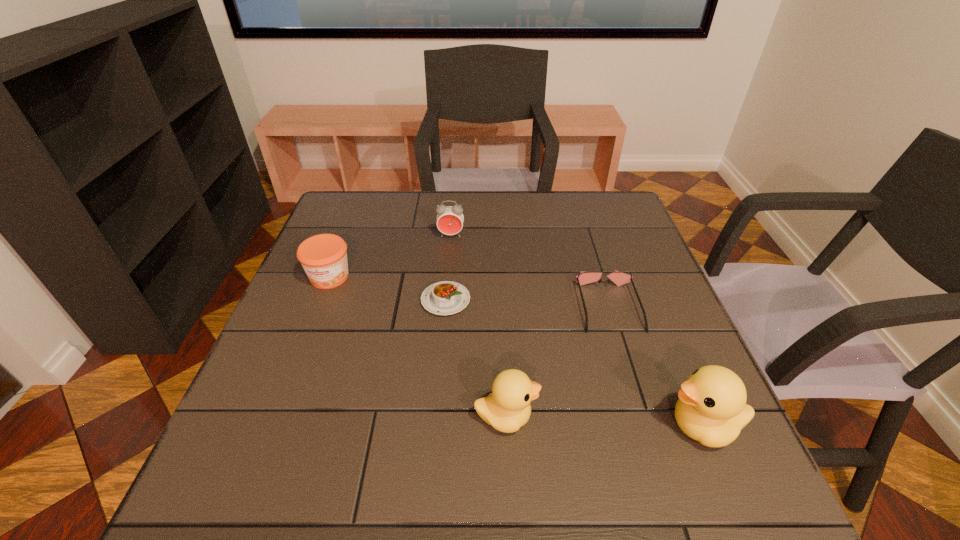
The height and width of the screenshot is (540, 960). What are the coordinates of `sunglasses at the right edge` in the screenshot? It's located at (619, 278).

At what (x,y) coordinates should I click in order to perform the action: click on object that is at the near right corner. Please return your answer as a coordinate pair (x, y). Looking at the image, I should click on (711, 409).

You are a GUI agent. You are given a task and a screenshot of the screen. Output one action in this format:
    pyautogui.click(x=<x>, y=<y>)
    Task: Click on the vacant space at the far edge
    The image size is (960, 540).
    Given the screenshot: What is the action you would take?
    pyautogui.click(x=439, y=199)

This screenshot has width=960, height=540. Identify the location of vacant region at the near edge of the desktop. (328, 431).

You are a GUI agent. You are given a task and a screenshot of the screen. Output one action in this format:
    pyautogui.click(x=<x>, y=<y>)
    Task: Click on the free spot at the left edge of the desktop
    This screenshot has height=540, width=960.
    Given the screenshot: What is the action you would take?
    pyautogui.click(x=340, y=295)

At what (x,y) coordinates should I click in order to perform the action: click on free space at the right edge. Please return your answer as a coordinate pair (x, y). Image resolution: width=960 pixels, height=540 pixels. Looking at the image, I should click on tap(665, 398).

I want to click on vacant space at the near left corner of the desktop, so click(x=321, y=415).

Find the location of a particular element. The height and width of the screenshot is (540, 960). vacant space at the far right corner is located at coordinates (597, 218).

Identify the location of unoccupied area between the sunglasses and the shortest object. The image size is (960, 540). (527, 303).

You are a GUI agent. You are given a task and a screenshot of the screen. Output one action in this format:
    pyautogui.click(x=<x>, y=<y>)
    Task: Click on the vacant space that's between the shorter duck and the leftmost object
    
    Given the screenshot: What is the action you would take?
    pyautogui.click(x=418, y=347)